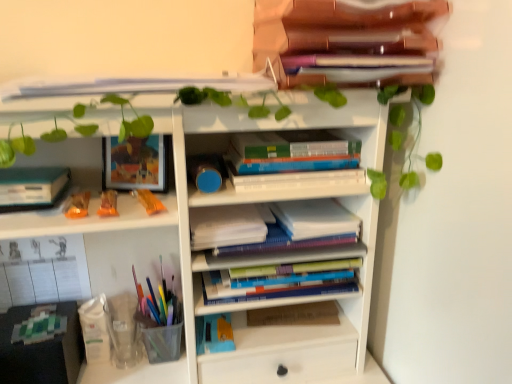
The width and height of the screenshot is (512, 384). What are the coordinates of `free space above hardcover book at left, the 1th paperback book in the left-to-right sequence (from a real-world perspective)` in the screenshot? It's located at (33, 170).